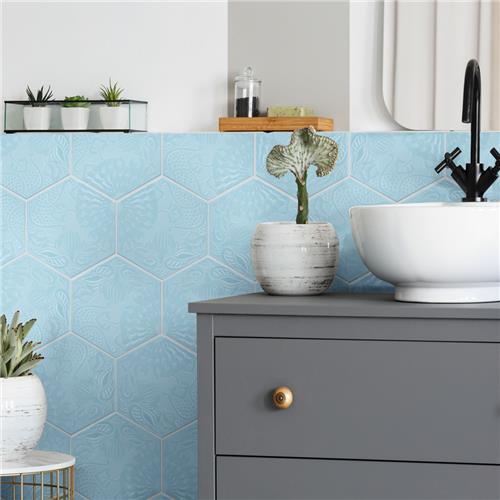
This screenshot has width=500, height=500. Find the location of `succulent`. succulent is located at coordinates tap(109, 90), tap(75, 95), tap(33, 98).